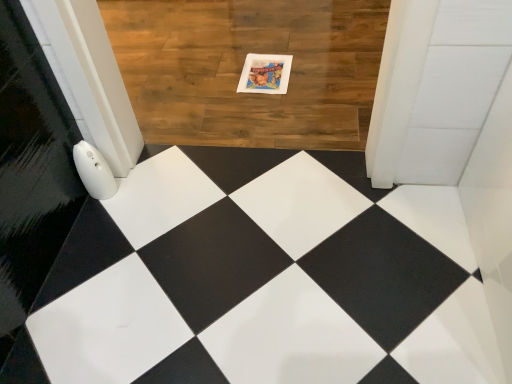
Question: Can you confirm if matte paper postcard at center is bigger than wooden floor at center?

Choices:
 (A) yes
 (B) no

Answer: (B)

Question: Is matte paper postcard at center oriented towards wooden floor at center?

Choices:
 (A) yes
 (B) no

Answer: (A)

Question: Is wooden floor at center at the back of matte paper postcard at center?

Choices:
 (A) no
 (B) yes

Answer: (B)

Question: Considering the relative positions of matte paper postcard at center and wooden floor at center in the image provided, is matte paper postcard at center to the left of wooden floor at center from the viewer's perspective?

Choices:
 (A) no
 (B) yes

Answer: (A)

Question: From a real-world perspective, is matte paper postcard at center below wooden floor at center?

Choices:
 (A) yes
 (B) no

Answer: (B)

Question: From a real-world perspective, is matte paper postcard at center positioned over wooden floor at center based on gravity?

Choices:
 (A) no
 (B) yes

Answer: (B)

Question: Can you confirm if wooden floor at center is thinner than matte paper postcard at center?

Choices:
 (A) no
 (B) yes

Answer: (A)

Question: From the image's perspective, would you say wooden floor at center is positioned over matte paper postcard at center?

Choices:
 (A) no
 (B) yes

Answer: (B)

Question: Could you tell me if wooden floor at center is turned towards matte paper postcard at center?

Choices:
 (A) no
 (B) yes

Answer: (B)

Question: Is wooden floor at center not within matte paper postcard at center?

Choices:
 (A) yes
 (B) no

Answer: (A)

Question: From a real-world perspective, is wooden floor at center under matte paper postcard at center?

Choices:
 (A) yes
 (B) no

Answer: (A)

Question: Can you confirm if wooden floor at center is smaller than matte paper postcard at center?

Choices:
 (A) no
 (B) yes

Answer: (A)

Question: Relative to matte paper postcard at center, is wooden floor at center in front or behind?

Choices:
 (A) front
 (B) behind

Answer: (A)